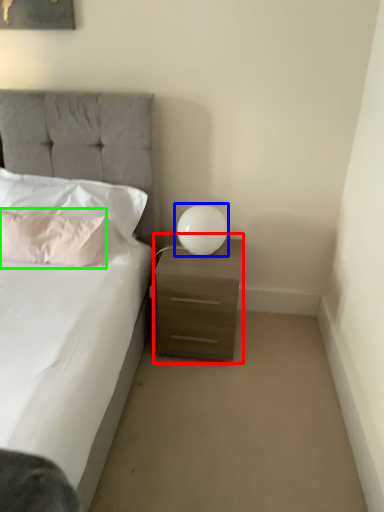
Question: Which object is the farthest from nightstand (highlighted by a red box)? Choose among these: table lamp (highlighted by a blue box) or pillow (highlighted by a green box).

Choices:
 (A) table lamp
 (B) pillow

Answer: (B)